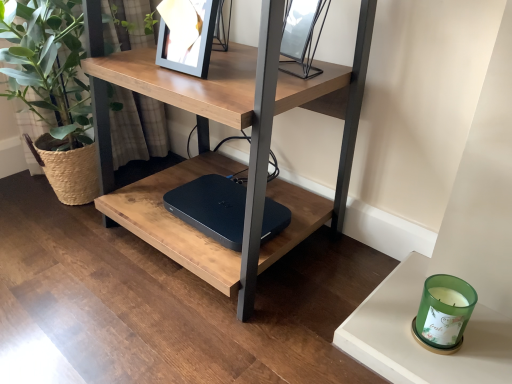
At what (x,y) coordinates should I click in order to perform the action: click on vacant space that is to the left of green glass candle at lower right. Please return your answer as a coordinate pair (x, y). Looking at the image, I should click on (331, 340).